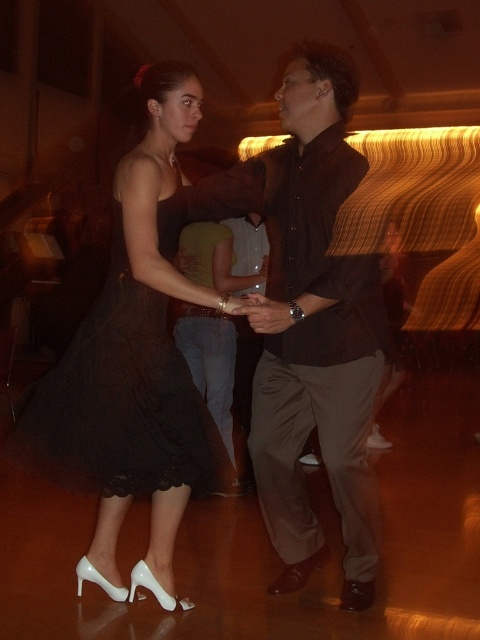
Can you confirm if black lace dress at center is taller than brown matte shirt at center?

No, black lace dress at center is not taller than brown matte shirt at center.

Which is below, black lace dress at center or brown matte shirt at center?

black lace dress at center is lower down.

This screenshot has width=480, height=640. What do you see at coordinates (140, 353) in the screenshot? I see `black lace dress at center` at bounding box center [140, 353].

At what (x,y) coordinates should I click in order to perform the action: click on black lace dress at center. Please return your answer as a coordinate pair (x, y). This screenshot has width=480, height=640. Looking at the image, I should click on (140, 353).

What do you see at coordinates (140, 353) in the screenshot? This screenshot has height=640, width=480. I see `black lace dress at center` at bounding box center [140, 353].

Can you confirm if black lace dress at center is shorter than black lace dress at left?

Incorrect, black lace dress at center's height does not fall short of black lace dress at left's.

Describe the element at coordinates (140, 353) in the screenshot. I see `black lace dress at center` at that location.

Locate an element on the screen. Image resolution: width=480 pixels, height=640 pixels. black lace dress at center is located at coordinates (140, 353).

Does brown matte shirt at center have a larger size compared to black lace dress at left?

Correct, brown matte shirt at center is larger in size than black lace dress at left.

Is point (308, 202) positioned behind point (140, 472)?

Yes, point (308, 202) is farther from viewer.

Is point (279, 385) farther from viewer compared to point (132, 445)?

Yes, point (279, 385) is farther from viewer.

The width and height of the screenshot is (480, 640). What are the coordinates of `brown matte shirt at center` in the screenshot? It's located at (315, 333).